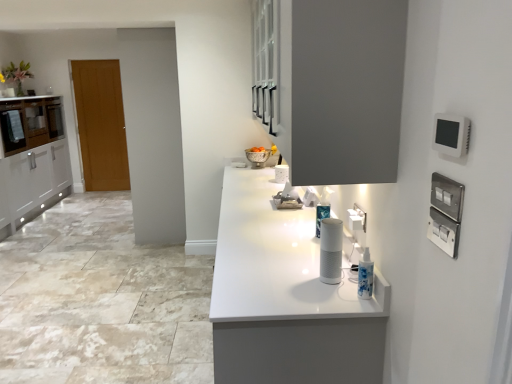
What is the approximate width of white matte speaker at center?

The width of white matte speaker at center is 5.15 inches.

Image resolution: width=512 pixels, height=384 pixels. I want to click on white matte speaker at center, so click(331, 250).

Measure the distance between white plastic electric outlet at right and camera.

white plastic electric outlet at right and camera are 5.31 feet apart from each other.

The image size is (512, 384). Describe the element at coordinates (357, 218) in the screenshot. I see `white plastic electric outlet at right` at that location.

Identify the location of matte gray cabinet at upper center, arranged as the first cabinetry when viewed from the front. The width and height of the screenshot is (512, 384). (331, 86).

You are a GUI agent. You are given a task and a screenshot of the screen. Output one action in this format:
    pyautogui.click(x=<x>, y=<y>)
    Task: Click on the matte white cabinet at left, which is the second cabinetry in front-to-back order
    The width and height of the screenshot is (512, 384).
    Given the screenshot: What is the action you would take?
    pyautogui.click(x=30, y=123)

At what (x,y) coordinates should I click in order to perform the action: click on white glossy countertop at center. Please return your answer as a coordinate pair (x, y). Looking at the image, I should click on (286, 297).

This screenshot has width=512, height=384. In order to click on white matte speaker at center in this screenshot , I will do `click(331, 250)`.

Measure the distance between white plastic electric outlet at right and white matte speaker at center.

white plastic electric outlet at right and white matte speaker at center are 5.40 inches apart.

Considering the points (361, 215) and (327, 258), which point is in front, point (361, 215) or point (327, 258)?

Positioned in front is point (327, 258).

Which of these two, white plastic electric outlet at right or white matte speaker at center, is smaller?

white plastic electric outlet at right is smaller.

Is white matte speaker at center located within white plastic electric outlet at right?

No, white matte speaker at center is not a part of white plastic electric outlet at right.

From a real-world perspective, is matte gray cabinet at upper center, the second cabinetry when ordered from back to front, on white plastic electric outlet at right?

Yes, from a real-world perspective, matte gray cabinet at upper center, the second cabinetry when ordered from back to front, is on top of white plastic electric outlet at right.

What's the angular difference between matte gray cabinet at upper center, the first cabinetry when ordered from right to left, and white plastic electric outlet at right's facing directions?

The angle between the facing direction of matte gray cabinet at upper center, the first cabinetry when ordered from right to left, and the facing direction of white plastic electric outlet at right is 0.581 degrees.

Considering the positions of points (379, 84) and (362, 230), is point (379, 84) farther from camera compared to point (362, 230)?

No, (379, 84) is in front of (362, 230).

Between matte gray cabinet at upper center, positioned as the second cabinetry in left-to-right order, and white plastic electric outlet at right, which one has smaller width?

Thinner between the two is white plastic electric outlet at right.

Between white glossy countertop at center and matte white cabinet at left, which is the second cabinetry in front-to-back order, which one is positioned behind?

matte white cabinet at left, which is the second cabinetry in front-to-back order, is more distant.

Is white glossy countertop at center spatially inside matte white cabinet at left, which is the second cabinetry in front-to-back order, or outside of it?

white glossy countertop at center is outside matte white cabinet at left, which is the second cabinetry in front-to-back order.

From the image's perspective, between white glossy countertop at center and matte white cabinet at left, which is the second cabinetry in front-to-back order, which one is located above?

matte white cabinet at left, which is the second cabinetry in front-to-back order.

Looking at the image, does white plastic electric outlet at right seem bigger or smaller compared to wooden door at left?

white plastic electric outlet at right is smaller than wooden door at left.

From the picture: From a real-world perspective, is white plastic electric outlet at right over wooden door at left?

Indeed, from a real-world perspective, white plastic electric outlet at right stands above wooden door at left.

Which object is positioned more to the left, white plastic electric outlet at right or wooden door at left?

From the viewer's perspective, wooden door at left appears more on the left side.

Is white plastic electric outlet at right facing towards silver metallic bowl at center?

No, white plastic electric outlet at right does not turn towards silver metallic bowl at center.

From the image's perspective, is white plastic electric outlet at right below silver metallic bowl at center?

Indeed, from the image's perspective, white plastic electric outlet at right is shown beneath silver metallic bowl at center.

From a real-world perspective, does white plastic electric outlet at right sit lower than silver metallic bowl at center?

Incorrect, from a real-world perspective, white plastic electric outlet at right is higher than silver metallic bowl at center.

Who is taller, white plastic electric outlet at right or silver metallic bowl at center?

Standing taller between the two is silver metallic bowl at center.

Considering the positions of point (354, 51) and point (356, 381), is point (354, 51) closer or farther from the camera than point (356, 381)?

Point (354, 51).

From a real-world perspective, is matte gray cabinet at upper center, the first cabinetry when ordered from right to left, above or below white glossy countertop at center?

In terms of real-world spatial position, matte gray cabinet at upper center, the first cabinetry when ordered from right to left, is above white glossy countertop at center.

Considering the relative sizes of matte gray cabinet at upper center, the first cabinetry when ordered from right to left, and white glossy countertop at center in the image provided, is matte gray cabinet at upper center, the first cabinetry when ordered from right to left, thinner than white glossy countertop at center?

Indeed, matte gray cabinet at upper center, the first cabinetry when ordered from right to left, has a lesser width compared to white glossy countertop at center.

Where is `cabinetry in front of the white glossy countertop at center`? This screenshot has height=384, width=512. cabinetry in front of the white glossy countertop at center is located at coordinates (331, 86).

Which is farther from the camera, (x=11, y=147) or (x=261, y=163)?

The point (x=11, y=147) is farther from the camera.

Can you tell me how much matte white cabinet at left, which ranks as the 1th cabinetry in left-to-right order, and silver metallic bowl at center differ in facing direction?

177 degrees.

In terms of height, does matte white cabinet at left, marked as the second cabinetry in a right-to-left arrangement, look taller or shorter compared to silver metallic bowl at center?

Considering their sizes, matte white cabinet at left, marked as the second cabinetry in a right-to-left arrangement, has more height than silver metallic bowl at center.

Is matte white cabinet at left, marked as the second cabinetry in a right-to-left arrangement, facing towards silver metallic bowl at center?

Yes.

Locate an element on the screen. This screenshot has width=512, height=384. electric outlet lying above the white matte speaker at center (from the image's perspective) is located at coordinates (357, 218).

Identify the location of the 2nd cabinetry located above the white plastic electric outlet at right (from a real-world perspective). (331, 86).

Which object lies further to the anchor point white plastic electric outlet at right, white glossy countertop at center or matte white cabinet at left, which ranks as the first cabinetry in back-to-front order?

matte white cabinet at left, which ranks as the first cabinetry in back-to-front order, lies further to white plastic electric outlet at right than the other object.

Estimate the real-world distances between objects in this image. Which object is further from white matte speaker at center, silver metallic bowl at center or white glossy countertop at center?

Based on the image, silver metallic bowl at center appears to be further to white matte speaker at center.

When comparing their distances from silver metallic bowl at center, does matte white cabinet at left, marked as the second cabinetry in a right-to-left arrangement, or matte gray cabinet at upper center, the second cabinetry when ordered from back to front, seem closer?

Based on the image, matte gray cabinet at upper center, the second cabinetry when ordered from back to front, appears to be nearer to silver metallic bowl at center.

Considering their positions, is silver metallic bowl at center positioned closer to matte white cabinet at left, marked as the second cabinetry in a right-to-left arrangement, than white plastic electric outlet at right?

silver metallic bowl at center is positioned closer to the anchor matte white cabinet at left, marked as the second cabinetry in a right-to-left arrangement.

Looking at the image, which one is located closer to matte white cabinet at left, marked as the second cabinetry in a right-to-left arrangement, silver metallic bowl at center or white matte speaker at center?

silver metallic bowl at center is closer to matte white cabinet at left, marked as the second cabinetry in a right-to-left arrangement.

From the image, which object appears to be farther from white plastic electric outlet at right, white matte speaker at center or matte gray cabinet at upper center, positioned as the second cabinetry in left-to-right order?

matte gray cabinet at upper center, positioned as the second cabinetry in left-to-right order.

Which object lies nearer to the anchor point white plastic electric outlet at right, white glossy countertop at center or matte gray cabinet at upper center, the second cabinetry when ordered from back to front?

white glossy countertop at center is positioned closer to the anchor white plastic electric outlet at right.

Estimate the real-world distances between objects in this image. Which object is further from matte gray cabinet at upper center, the first cabinetry when ordered from right to left, silver metallic bowl at center or white plastic electric outlet at right?

silver metallic bowl at center is positioned further to the anchor matte gray cabinet at upper center, the first cabinetry when ordered from right to left.

You are a GUI agent. You are given a task and a screenshot of the screen. Output one action in this format:
    pyautogui.click(x=<x>, y=<y>)
    Task: Click on the cabinetry between white matte speaker at center and wooden door at left from front to back
    This screenshot has height=384, width=512.
    Given the screenshot: What is the action you would take?
    pyautogui.click(x=30, y=123)

Find the location of a particular element. appliance between white glossy countertop at center and silver metallic bowl at center along the z-axis is located at coordinates (331, 250).

Identify the location of sink between matte white cabinet at left, marked as the second cabinetry in a right-to-left arrangement, and white plastic electric outlet at right. (259, 156).

Where is `electric outlet located between white matte speaker at center and silver metallic bowl at center in the depth direction`? The height and width of the screenshot is (384, 512). electric outlet located between white matte speaker at center and silver metallic bowl at center in the depth direction is located at coordinates (357, 218).